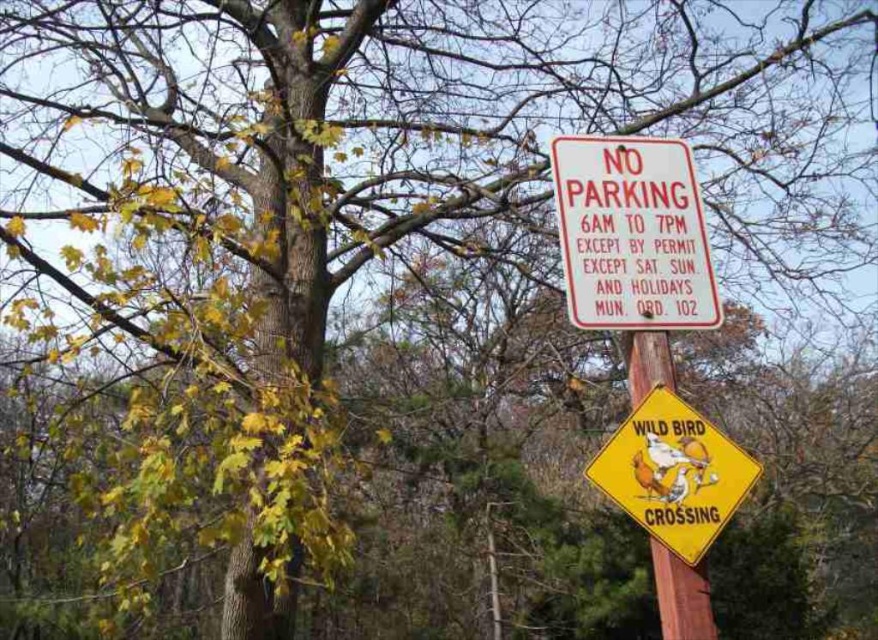
You are a pedestrian trying to read both the white paper sign at upper center and the wooden post at center. Which one is positioned higher in the image?

The white paper sign at upper center is positioned higher than the wooden post at center.